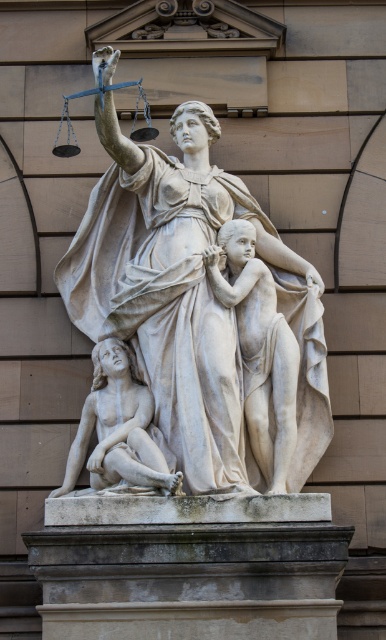
You are an art conservator with a 18 feet long protective cover. You need to cover both the white marble statue at center and the white marble figure at lower left. Can you determine if the cover is long enough to cover both objects without overlapping them?

The distance between the white marble statue at center and the white marble figure at lower left is 19.10 feet. Since the protective cover is only 18 feet long, it is not long enough to cover both objects without overlapping them.